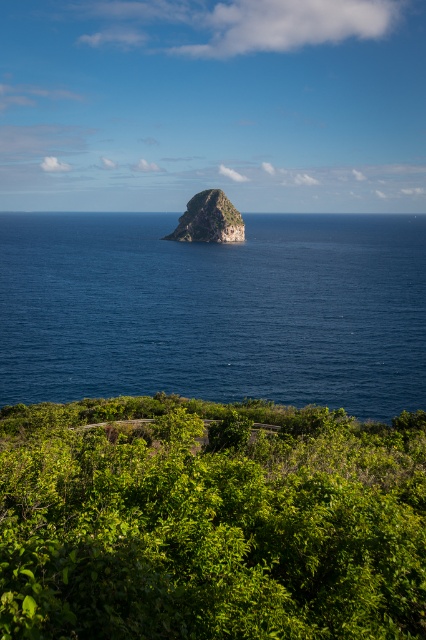
What do you see at coordinates (210, 522) in the screenshot? I see `green leafy shrubs at lower center` at bounding box center [210, 522].

Which is behind, point (91, 412) or point (186, 228)?

Point (186, 228)

Does point (14, 586) lie in front of point (221, 196)?

Yes, point (14, 586) is in front of point (221, 196).

What are the coordinates of `green leafy shrubs at lower center` in the screenshot? It's located at (210, 522).

The image size is (426, 640). Describe the element at coordinates (210, 522) in the screenshot. I see `green leafy shrubs at lower center` at that location.

Locate an element on the screen. This screenshot has height=640, width=426. green leafy shrubs at lower center is located at coordinates [210, 522].

Is deep blue water at center wider than rough granite rock at center?

Yes.

Can you confirm if deep blue water at center is positioned to the right of rough granite rock at center?

Yes, deep blue water at center is to the right of rough granite rock at center.

Who is more forward, (154, 307) or (181, 218)?

Point (154, 307) is in front.

You are a GUI agent. You are given a task and a screenshot of the screen. Output one action in this format:
    pyautogui.click(x=<x>, y=<y>)
    Task: Click on the deep blue water at center
    This screenshot has width=426, height=640.
    Given the screenshot: What is the action you would take?
    pyautogui.click(x=215, y=308)